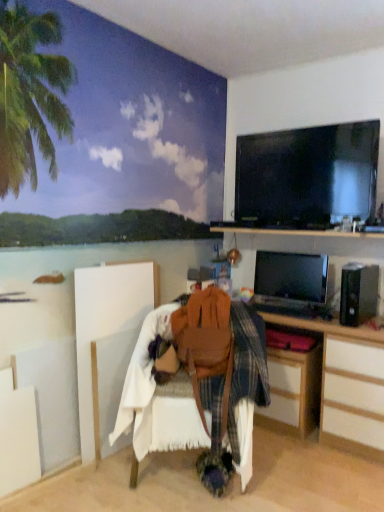
Question: From a real-world perspective, is brown leather bag at center physically above wooden desk at lower right?

Choices:
 (A) no
 (B) yes

Answer: (B)

Question: Is wooden desk at lower right surrounded by brown leather bag at center?

Choices:
 (A) yes
 (B) no

Answer: (B)

Question: Does brown leather bag at center have a smaller size compared to wooden desk at lower right?

Choices:
 (A) yes
 (B) no

Answer: (A)

Question: Can you confirm if brown leather bag at center is taller than wooden desk at lower right?

Choices:
 (A) no
 (B) yes

Answer: (A)

Question: Does brown leather bag at center come behind wooden desk at lower right?

Choices:
 (A) yes
 (B) no

Answer: (B)

Question: From a real-world perspective, is brown leather bag at center physically below wooden desk at lower right?

Choices:
 (A) yes
 (B) no

Answer: (B)

Question: Is wooden desk at lower right facing towards brown leather bag at center?

Choices:
 (A) yes
 (B) no

Answer: (A)

Question: Does wooden desk at lower right lie behind brown leather bag at center?

Choices:
 (A) no
 (B) yes

Answer: (B)

Question: Is wooden desk at lower right placed right next to brown leather bag at center?

Choices:
 (A) no
 (B) yes

Answer: (A)

Question: Is there a large distance between wooden desk at lower right and brown leather bag at center?

Choices:
 (A) no
 (B) yes

Answer: (A)

Question: Can brown leather bag at center be found inside wooden desk at lower right?

Choices:
 (A) no
 (B) yes

Answer: (A)

Question: From the image's perspective, is wooden desk at lower right below brown leather bag at center?

Choices:
 (A) yes
 (B) no

Answer: (A)

Question: From a real-world perspective, is wooden desk at lower right on black glossy screen at upper right, the second television positioned from the bottom?

Choices:
 (A) yes
 (B) no

Answer: (B)